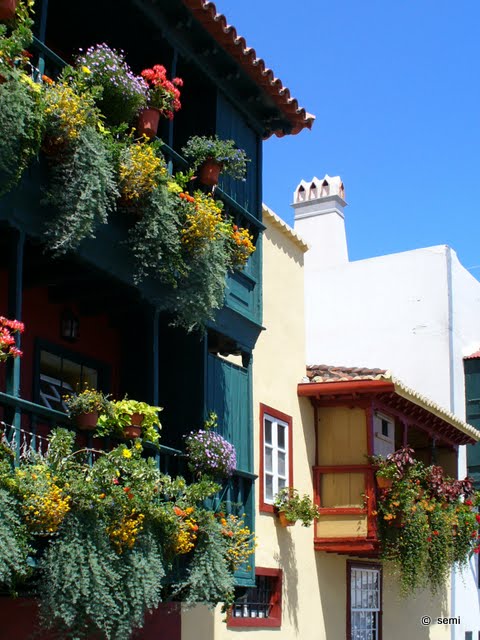
The height and width of the screenshot is (640, 480). Find the location of `windows`. windows is located at coordinates (271, 452), (258, 596), (385, 431), (68, 369).